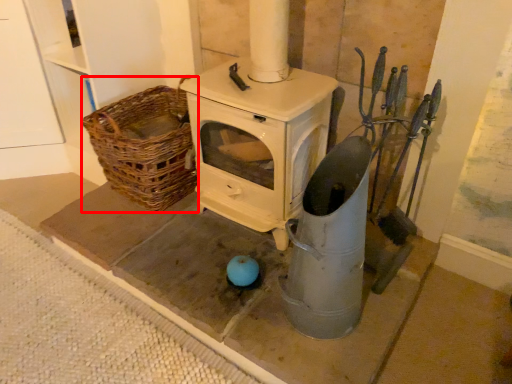
Question: From the image, what is the correct spatial relationship of basket (annotated by the red box) in relation to appliance?

Choices:
 (A) left
 (B) right

Answer: (A)